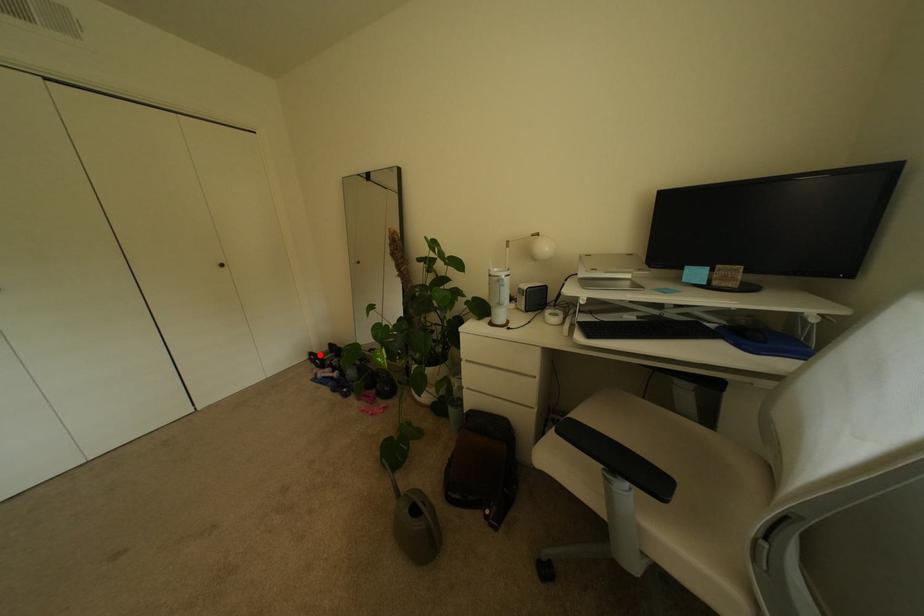
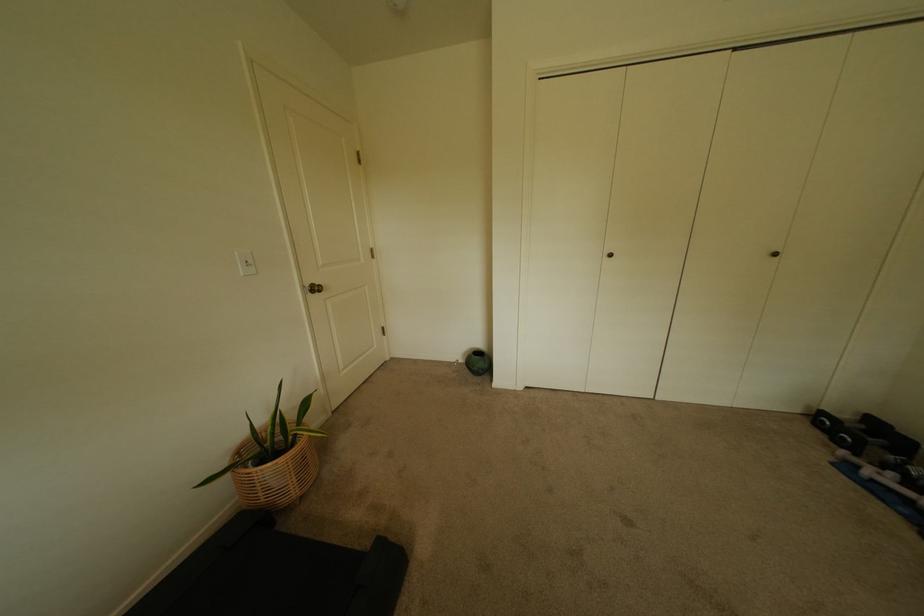
Find the pixel in the second image that matches the highlighted location in the first image.

(831, 415)